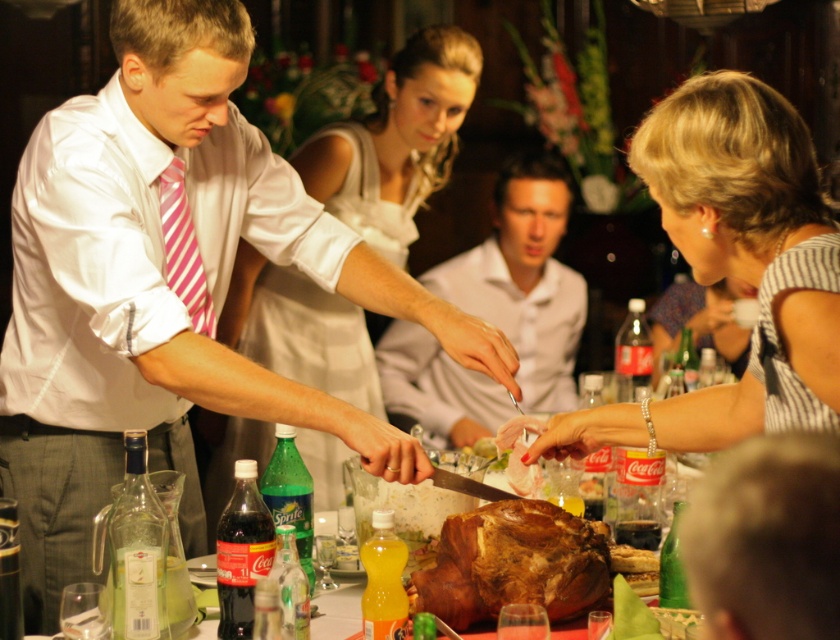
You are a guest at the event and want to move from the carving station to the dessert table. The carving station is at point (793, 216) and the dessert table is at point (576, 596). According to the scene description, which direction should you move to go from the carving station to the dessert table?

You should move towards the dessert table at point (576, 596) by moving backward since the carving station at point (793, 216) is in front of it. This means the dessert table is behind the carving station from your current position.